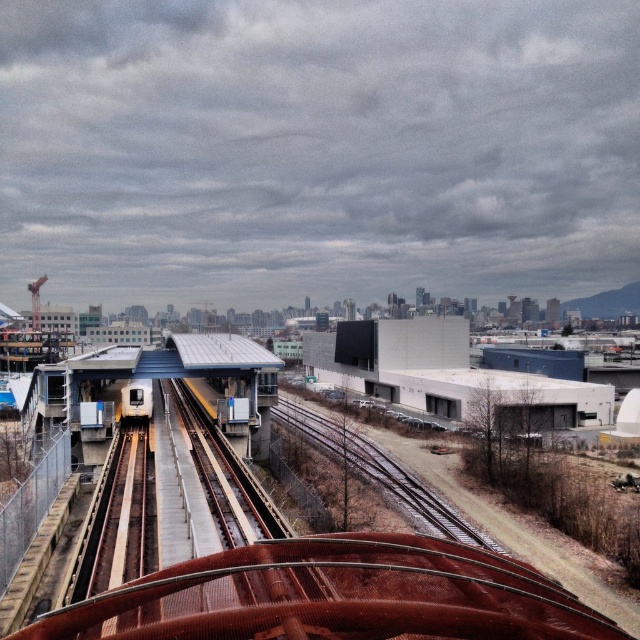
You are a photographer standing at the edge of the train station platform. You want to capture a photo of the metallic silver train at center without the gray concrete building at center blocking the view. Is this possible given their positions?

The gray concrete building at center is in front of the metallic silver train at center, so it will block the view of the train. Move to a different position to avoid the building.

You are a delivery drone flying over an urban area. Your GPS shows a destination at point (449, 376). According to the image, what type of structure will you find there?

At point (449, 376) lies gray concrete building at center.